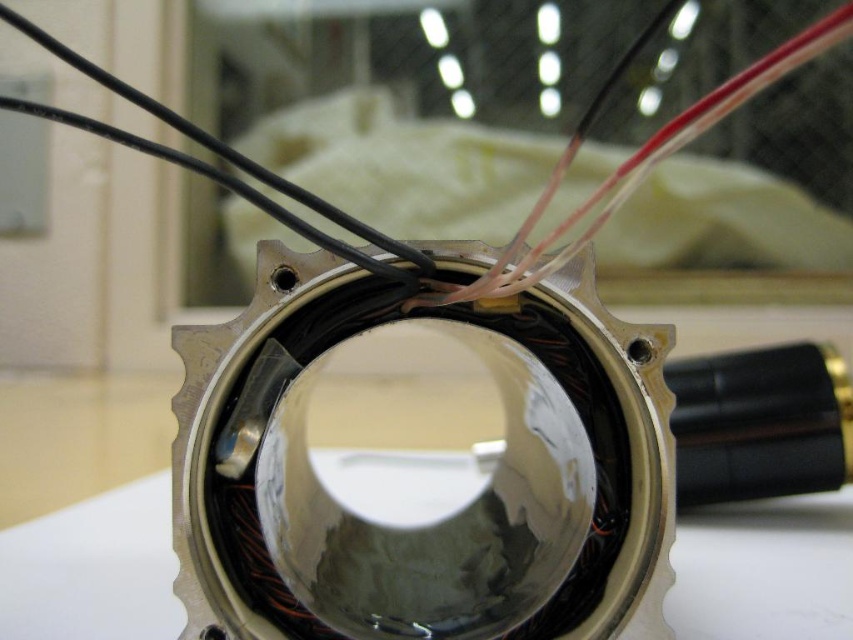
You are a technician working on a robotic arm. You need to connect a camera to the shiny metallic lens at center. The camera requires a 25 inch cable to function properly. Do you have enough cable length to connect them without any extension?

The distance between the shiny metallic lens at center and the camera is 25.77 inches. Since the required cable length is 25 inches, the available cable is slightly longer than needed. Therefore, you have enough cable length to connect them without needing an extension.

You are an engineer examining a mechanical component. You notice a point labeled at coordinates (421, 465). What object is located at this point?

The point at coordinates (421, 465) marks the location of a shiny metallic lens at the center of the component.